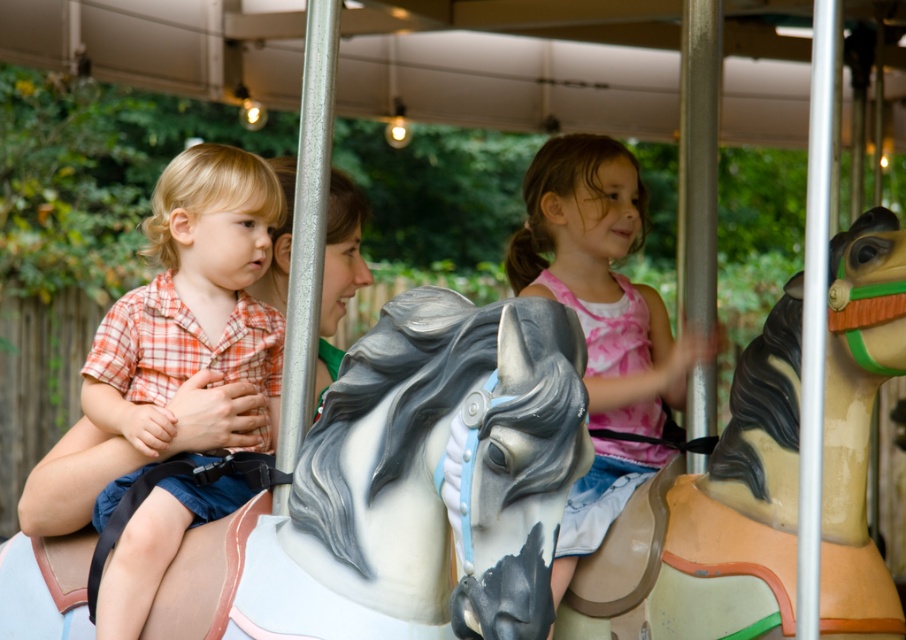
Question: Which object is the farthest from the white glossy horse at left?

Choices:
 (A) matte orange plaid shirt at left
 (B) matte brown horse at center
 (C) pink fabric dress at center

Answer: (C)

Question: Does white glossy horse at left come behind matte brown horse at center?

Choices:
 (A) no
 (B) yes

Answer: (A)

Question: Is matte brown horse at center bigger than pink fabric dress at center?

Choices:
 (A) yes
 (B) no

Answer: (B)

Question: Which of the following is the closest to the observer?

Choices:
 (A) pink fabric dress at center
 (B) matte brown horse at center
 (C) white glossy horse at left
 (D) matte orange plaid shirt at left

Answer: (C)

Question: Does matte brown horse at center have a lesser width compared to pink fabric dress at center?

Choices:
 (A) yes
 (B) no

Answer: (B)

Question: Which object is positioned farthest from the matte brown horse at center?

Choices:
 (A) matte orange plaid shirt at left
 (B) pink fabric dress at center

Answer: (A)